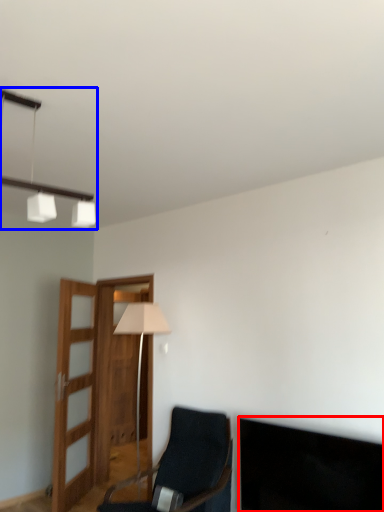
Question: Which object appears closest to the camera in this image, dark (highlighted by a red box) or lamp (highlighted by a blue box)?

Choices:
 (A) dark
 (B) lamp

Answer: (B)